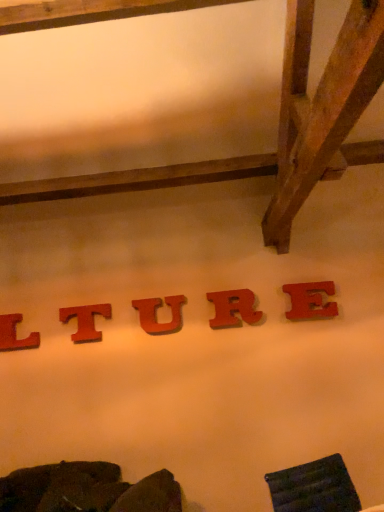
What do you see at coordinates (311, 301) in the screenshot?
I see `red matte letter e at center, the fifth letter viewed from the left` at bounding box center [311, 301].

The image size is (384, 512). Describe the element at coordinates (233, 308) in the screenshot. I see `matte wood letter r at center, which appears as the 2th letter when viewed from the right` at that location.

Image resolution: width=384 pixels, height=512 pixels. What do you see at coordinates (156, 314) in the screenshot?
I see `matte wood letter u at center, which is the 3th letter in left-to-right order` at bounding box center [156, 314].

The image size is (384, 512). In order to click on velvet dark green swivel chair at lower right in this screenshot , I will do `click(314, 487)`.

Measure the distance between red wood letter at lower left, arranged as the 5th letter when viewed from the right, and camera.

red wood letter at lower left, arranged as the 5th letter when viewed from the right, is 9.28 feet from camera.

What do you see at coordinates (85, 321) in the screenshot? I see `matte wood letter t at center, the second letter in the left-to-right sequence` at bounding box center [85, 321].

Find the location of a particular element. Image resolution: width=384 pixels, height=512 pixels. red matte letter e at center, arranged as the first letter when viewed from the right is located at coordinates (311, 301).

Considering the relative sizes of matte wood letter u at center, which is the 3th letter in left-to-right order, and red matte letter e at center, the fifth letter viewed from the left, in the image provided, is matte wood letter u at center, which is the 3th letter in left-to-right order, taller than red matte letter e at center, the fifth letter viewed from the left,?

Yes.

Does matte wood letter u at center, which is the 3th letter in left-to-right order, have a smaller size compared to red matte letter e at center, the fifth letter viewed from the left?

Yes, matte wood letter u at center, which is the 3th letter in left-to-right order, is smaller than red matte letter e at center, the fifth letter viewed from the left.

Is matte wood letter u at center, which is the 3th letter in left-to-right order, further to camera compared to red matte letter e at center, arranged as the first letter when viewed from the right?

Yes, matte wood letter u at center, which is the 3th letter in left-to-right order, is further from the viewer.

Consider the image. Is matte wood letter u at center, the 3th letter from the right, facing towards red matte letter e at center, the fifth letter viewed from the left?

No, matte wood letter u at center, the 3th letter from the right, is not oriented towards red matte letter e at center, the fifth letter viewed from the left.

Considering the sizes of matte wood letter t at center, which is counted as the 4th letter, starting from the right, and velvet dark green swivel chair at lower right in the image, is matte wood letter t at center, which is counted as the 4th letter, starting from the right, bigger or smaller than velvet dark green swivel chair at lower right?

matte wood letter t at center, which is counted as the 4th letter, starting from the right, is smaller than velvet dark green swivel chair at lower right.

Is matte wood letter t at center, which is counted as the 4th letter, starting from the right, at the right side of velvet dark green swivel chair at lower right?

No.

Are matte wood letter t at center, the second letter in the left-to-right sequence, and velvet dark green swivel chair at lower right beside each other?

matte wood letter t at center, the second letter in the left-to-right sequence, is not next to velvet dark green swivel chair at lower right, and they're not touching.

From the image's perspective, is matte wood letter t at center, the second letter in the left-to-right sequence, positioned above or below velvet dark green swivel chair at lower right?

Clearly, from the image's perspective, matte wood letter t at center, the second letter in the left-to-right sequence, is above velvet dark green swivel chair at lower right.

Does point (301, 293) appear closer or farther from the camera than point (279, 510)?

Point (301, 293) is positioned farther from the camera compared to point (279, 510).

Based on the photo, relative to velvet dark green swivel chair at lower right, is red matte letter e at center, arranged as the first letter when viewed from the right, in front or behind?

Clearly, red matte letter e at center, arranged as the first letter when viewed from the right, is behind velvet dark green swivel chair at lower right.

Is red matte letter e at center, arranged as the first letter when viewed from the right, not near velvet dark green swivel chair at lower right?

Absolutely, red matte letter e at center, arranged as the first letter when viewed from the right, is distant from velvet dark green swivel chair at lower right.

Which object is positioned more to the right, red matte letter e at center, arranged as the first letter when viewed from the right, or velvet dark green swivel chair at lower right?

red matte letter e at center, arranged as the first letter when viewed from the right.

Is point (12, 343) closer to camera compared to point (211, 301)?

No, it is behind (211, 301).

Is red wood letter at lower left, arranged as the 5th letter when viewed from the right, shorter than matte wood letter r at center, arranged as the 4th letter when viewed from the left?

Yes, red wood letter at lower left, arranged as the 5th letter when viewed from the right, is shorter than matte wood letter r at center, arranged as the 4th letter when viewed from the left.

Considering the relative sizes of red wood letter at lower left, the first letter in the left-to-right sequence, and matte wood letter r at center, arranged as the 4th letter when viewed from the left, in the image provided, is red wood letter at lower left, the first letter in the left-to-right sequence, wider than matte wood letter r at center, arranged as the 4th letter when viewed from the left,?

In fact, red wood letter at lower left, the first letter in the left-to-right sequence, might be narrower than matte wood letter r at center, arranged as the 4th letter when viewed from the left.

Locate an element on the screen. the 3rd letter in front when counting from the red wood letter at lower left, the first letter in the left-to-right sequence is located at coordinates (233, 308).

Is red wood letter at lower left, arranged as the 5th letter when viewed from the right, at the back of matte wood letter u at center, the 3th letter from the right?

No, matte wood letter u at center, the 3th letter from the right, is not facing away from red wood letter at lower left, arranged as the 5th letter when viewed from the right.

Is matte wood letter u at center, which is the 3th letter in left-to-right order, directly adjacent to red wood letter at lower left, arranged as the 5th letter when viewed from the right?

No, matte wood letter u at center, which is the 3th letter in left-to-right order, is not with red wood letter at lower left, arranged as the 5th letter when viewed from the right.

Based on their positions, is matte wood letter u at center, the 3th letter from the right, located to the left or right of red wood letter at lower left, arranged as the 5th letter when viewed from the right?

matte wood letter u at center, the 3th letter from the right, is to the right of red wood letter at lower left, arranged as the 5th letter when viewed from the right.

From the image's perspective, is matte wood letter u at center, the 3th letter from the right, over red wood letter at lower left, arranged as the 5th letter when viewed from the right?

Yes, from the image's perspective, matte wood letter u at center, the 3th letter from the right, is over red wood letter at lower left, arranged as the 5th letter when viewed from the right.

From a real-world perspective, who is located lower, velvet dark green swivel chair at lower right or matte wood letter t at center, the second letter in the left-to-right sequence?

In real-world perspective, velvet dark green swivel chair at lower right is lower.

Considering the relative sizes of velvet dark green swivel chair at lower right and matte wood letter t at center, the second letter in the left-to-right sequence, in the image provided, is velvet dark green swivel chair at lower right smaller than matte wood letter t at center, the second letter in the left-to-right sequence,?

Actually, velvet dark green swivel chair at lower right might be larger than matte wood letter t at center, the second letter in the left-to-right sequence.

Is velvet dark green swivel chair at lower right at the right side of matte wood letter t at center, the second letter in the left-to-right sequence?

Indeed, velvet dark green swivel chair at lower right is positioned on the right side of matte wood letter t at center, the second letter in the left-to-right sequence.

Which object is wider, velvet dark green swivel chair at lower right or matte wood letter t at center, the second letter in the left-to-right sequence?

With larger width is velvet dark green swivel chair at lower right.

Is matte wood letter t at center, which is counted as the 4th letter, starting from the right, in contact with red wood letter at lower left, the first letter in the left-to-right sequence?

No, matte wood letter t at center, which is counted as the 4th letter, starting from the right, is not touching red wood letter at lower left, the first letter in the left-to-right sequence.

Considering the points (89, 326) and (9, 338), which point is in front, point (89, 326) or point (9, 338)?

The point (89, 326) is closer.

Which is more to the left, matte wood letter t at center, which is counted as the 4th letter, starting from the right, or red wood letter at lower left, arranged as the 5th letter when viewed from the right?

red wood letter at lower left, arranged as the 5th letter when viewed from the right, is more to the left.

Is matte wood letter t at center, which is counted as the 4th letter, starting from the right, inside or outside of red wood letter at lower left, arranged as the 5th letter when viewed from the right?

matte wood letter t at center, which is counted as the 4th letter, starting from the right, is spatially situated outside red wood letter at lower left, arranged as the 5th letter when viewed from the right.

This screenshot has height=512, width=384. In order to click on letter that is the 2nd object located behind the red matte letter e at center, arranged as the first letter when viewed from the right in this screenshot , I will do `click(156, 314)`.

You are a GUI agent. You are given a task and a screenshot of the screen. Output one action in this format:
    pyautogui.click(x=<x>, y=<y>)
    Task: Click on the letter that is the 3rd object to the left of the velvet dark green swivel chair at lower right, starting at the anchor
    
    Given the screenshot: What is the action you would take?
    pyautogui.click(x=85, y=321)

Estimate the real-world distances between objects in this image. Which object is closer to matte wood letter u at center, the 3th letter from the right, velvet dark green swivel chair at lower right or red wood letter at lower left, arranged as the 5th letter when viewed from the right?

red wood letter at lower left, arranged as the 5th letter when viewed from the right.

Looking at the image, which one is located closer to matte wood letter u at center, the 3th letter from the right, red wood letter at lower left, arranged as the 5th letter when viewed from the right, or velvet dark green swivel chair at lower right?

The object closer to matte wood letter u at center, the 3th letter from the right, is red wood letter at lower left, arranged as the 5th letter when viewed from the right.

Estimate the real-world distances between objects in this image. Which object is further from matte wood letter r at center, arranged as the 4th letter when viewed from the left, matte wood letter u at center, the 3th letter from the right, or red wood letter at lower left, arranged as the 5th letter when viewed from the right?

Among the two, red wood letter at lower left, arranged as the 5th letter when viewed from the right, is located further to matte wood letter r at center, arranged as the 4th letter when viewed from the left.

Which object lies nearer to the anchor point red wood letter at lower left, arranged as the 5th letter when viewed from the right, velvet dark green swivel chair at lower right or matte wood letter u at center, the 3th letter from the right?

matte wood letter u at center, the 3th letter from the right, is positioned closer to the anchor red wood letter at lower left, arranged as the 5th letter when viewed from the right.

Estimate the real-world distances between objects in this image. Which object is closer to matte wood letter r at center, arranged as the 4th letter when viewed from the left, red matte letter e at center, the fifth letter viewed from the left, or red wood letter at lower left, arranged as the 5th letter when viewed from the right?

Among the two, red matte letter e at center, the fifth letter viewed from the left, is located nearer to matte wood letter r at center, arranged as the 4th letter when viewed from the left.

Based on their spatial positions, is matte wood letter u at center, the 3th letter from the right, or matte wood letter t at center, which is counted as the 4th letter, starting from the right, closer to red wood letter at lower left, arranged as the 5th letter when viewed from the right?

matte wood letter t at center, which is counted as the 4th letter, starting from the right, lies closer to red wood letter at lower left, arranged as the 5th letter when viewed from the right, than the other object.

Based on their spatial positions, is red matte letter e at center, the fifth letter viewed from the left, or matte wood letter u at center, the 3th letter from the right, closer to velvet dark green swivel chair at lower right?

Based on the image, red matte letter e at center, the fifth letter viewed from the left, appears to be nearer to velvet dark green swivel chair at lower right.

Estimate the real-world distances between objects in this image. Which object is further from matte wood letter u at center, which is the 3th letter in left-to-right order, red matte letter e at center, the fifth letter viewed from the left, or velvet dark green swivel chair at lower right?

The object further to matte wood letter u at center, which is the 3th letter in left-to-right order, is velvet dark green swivel chair at lower right.

What are the coordinates of `letter located between matte wood letter t at center, which is counted as the 4th letter, starting from the right, and matte wood letter r at center, arranged as the 4th letter when viewed from the left, in the left-right direction` in the screenshot? It's located at (156, 314).

At what (x,y) coordinates should I click in order to perform the action: click on letter between matte wood letter u at center, the 3th letter from the right, and red matte letter e at center, the fifth letter viewed from the left, from left to right. Please return your answer as a coordinate pair (x, y). Looking at the image, I should click on (233, 308).

Identify the location of letter positioned between velvet dark green swivel chair at lower right and matte wood letter r at center, which appears as the 2th letter when viewed from the right, from near to far. The height and width of the screenshot is (512, 384). (311, 301).

You are a GUI agent. You are given a task and a screenshot of the screen. Output one action in this format:
    pyautogui.click(x=<x>, y=<y>)
    Task: Click on the letter located between red wood letter at lower left, arranged as the 5th letter when viewed from the right, and matte wood letter u at center, which is the 3th letter in left-to-right order, in the left-right direction
    
    Given the screenshot: What is the action you would take?
    pyautogui.click(x=85, y=321)